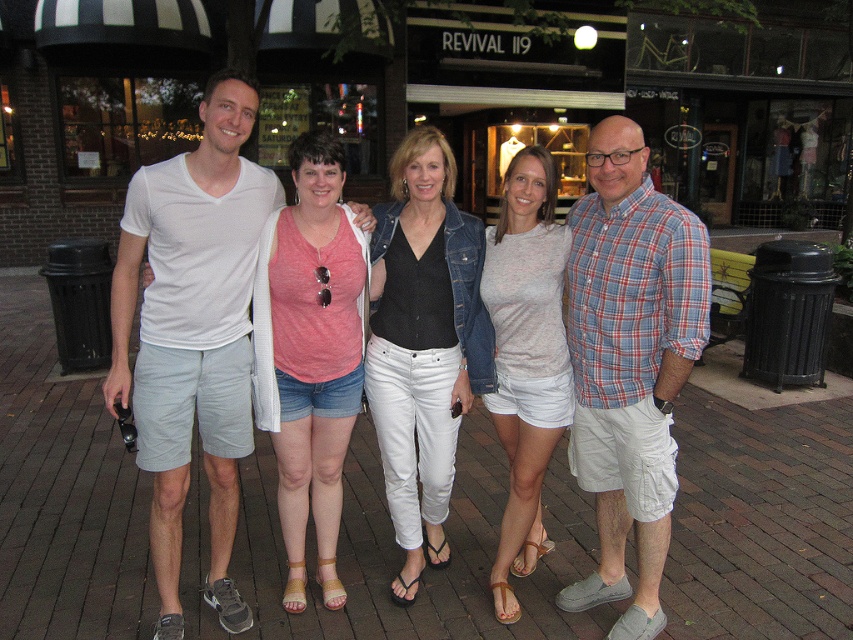
Based on the photo, you are a photographer trying to capture a candid shot of the group. Your camera has a lens that can focus on objects within a 18 inch range. You want to focus on both the white cotton shorts at center and the plaid cotton shirt at right. Can your camera focus on both at the same time?

The distance between the white cotton shorts at center and the plaid cotton shirt at right is 19.06 inches. Since the camera lens can only focus within an 18 inch range, it cannot capture both items in focus simultaneously.

You are a fashion designer observing the group of five people in the scene. You need to determine which clothing item, the white cotton shorts at center or the plaid cotton shirt at right, is taller. Which one is taller?

The white cotton shorts at center is taller than the plaid cotton shirt at right.

You are standing in a shopping district and want to take a photo of the group of five people. You need to position yourself exactly at the point with coordinates point (209, 276). How far will you be from the group?

The distance of point (209, 276) from viewer is 2.70 meters, so you will be 2.70 meters away from the group.